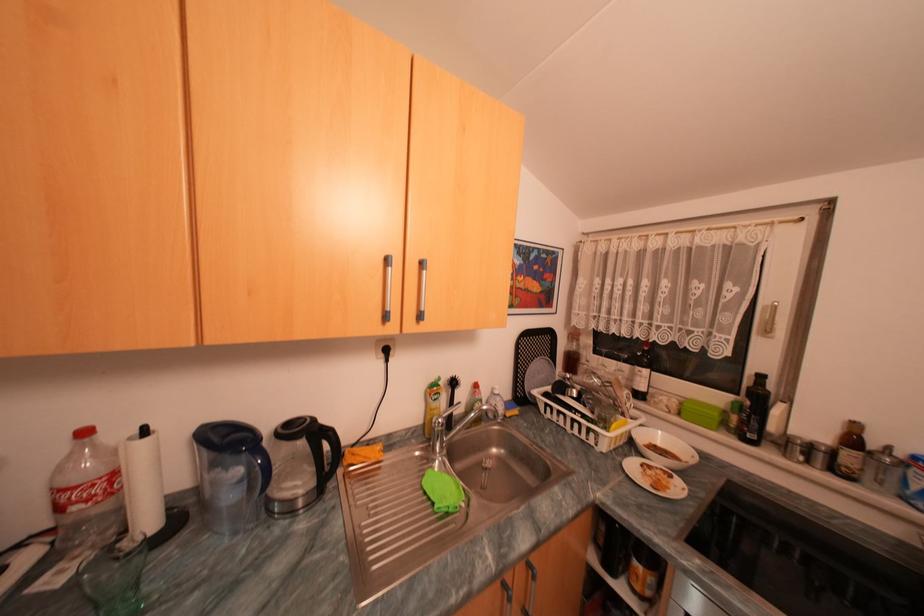
In order to click on small pot handle in this screenshot , I will do `click(619, 395)`.